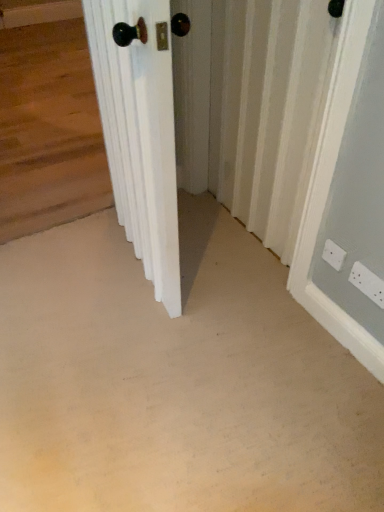
The image size is (384, 512). What are the coordinates of `free region on the left part of white wooden door at center` in the screenshot? It's located at (68, 261).